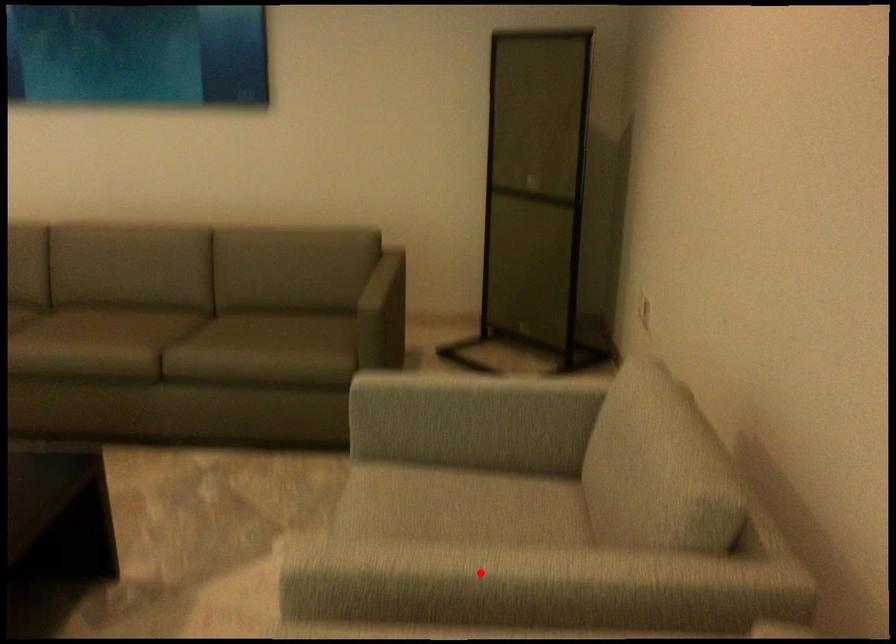
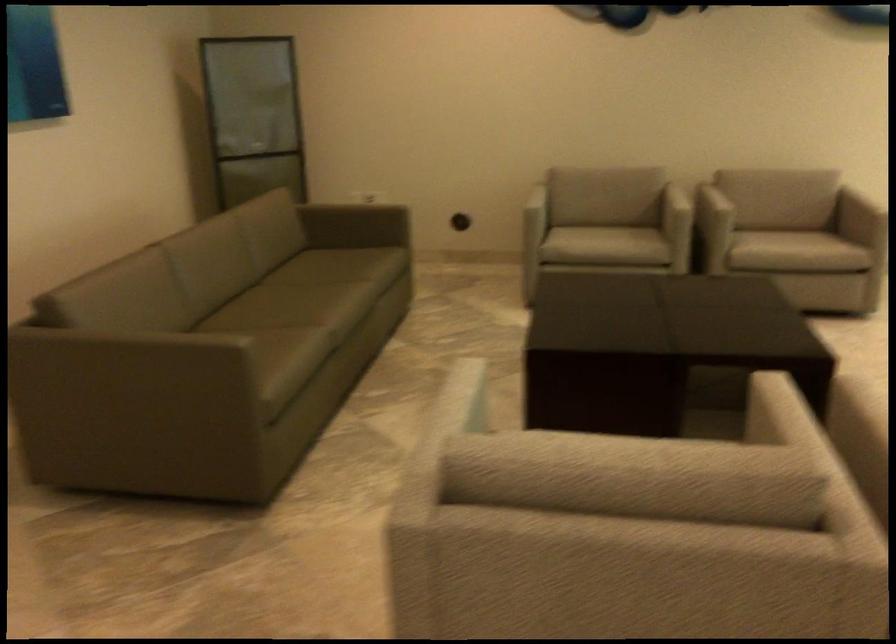
Question: I am providing you with two images of the same scene from different viewpoints. Given a red point in image1, look at the same physical point in image2. Is it:

Choices:
 (A) Closer to the viewpoint
 (B) Farther from the viewpoint

Answer: (B)